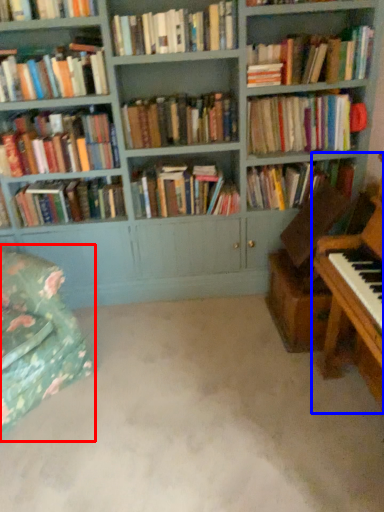
Question: Which object appears closest to the camera in this image, swivel chair (highlighted by a red box) or piano (highlighted by a blue box)?

Choices:
 (A) swivel chair
 (B) piano

Answer: (B)